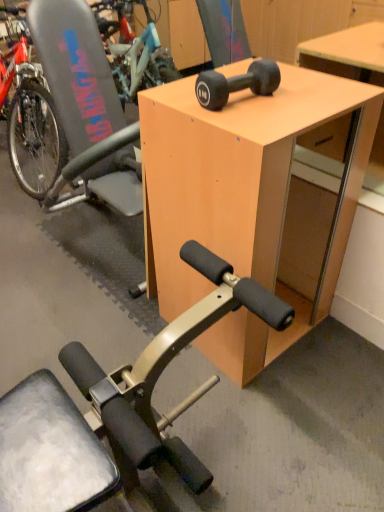
The width and height of the screenshot is (384, 512). What are the coordinates of `gray plastic swivel chair at left` in the screenshot? It's located at (86, 106).

Find the location of `black rubber dumbbell at upper center`. black rubber dumbbell at upper center is located at coordinates (236, 84).

This screenshot has width=384, height=512. In order to click on light wood desk at center in this screenshot , I will do `click(242, 199)`.

At what (x,y) coordinates should I click in order to perform the action: click on desk below the gray plastic swivel chair at left (from the image's perspective). Please return your answer as a coordinate pair (x, y). Image resolution: width=384 pixels, height=512 pixels. Looking at the image, I should click on (242, 199).

Would you say light wood desk at center is part of gray plastic swivel chair at left's contents?

Actually, light wood desk at center is outside gray plastic swivel chair at left.

Is gray plastic swivel chair at left in contact with light wood desk at center?

There is a gap between gray plastic swivel chair at left and light wood desk at center.

Considering the relative sizes of gray plastic swivel chair at left and light wood desk at center in the image provided, is gray plastic swivel chair at left bigger than light wood desk at center?

Yes, gray plastic swivel chair at left is bigger than light wood desk at center.

Image resolution: width=384 pixels, height=512 pixels. Identify the location of wheel in front of the gray plastic swivel chair at left. (236, 84).

From a real-world perspective, who is located higher, black rubber dumbbell at upper center or gray plastic swivel chair at left?

black rubber dumbbell at upper center, from a real-world perspective.

What's the angular difference between black rubber dumbbell at upper center and gray plastic swivel chair at left's facing directions?

There is a 0.546-degree angle between the facing directions of black rubber dumbbell at upper center and gray plastic swivel chair at left.

Is black rubber dumbbell at upper center wider or thinner than gray plastic swivel chair at left?

In the image, black rubber dumbbell at upper center appears to be more narrow than gray plastic swivel chair at left.

Does light wood desk at center lie behind black rubber dumbbell at upper center?

No, light wood desk at center is closer to the camera.

Is black rubber dumbbell at upper center inside light wood desk at center?

No, black rubber dumbbell at upper center is not a part of light wood desk at center.

How many degrees apart are the facing directions of light wood desk at center and black rubber dumbbell at upper center?

The facing directions of light wood desk at center and black rubber dumbbell at upper center are 1.64 degrees apart.

Considering the sizes of objects light wood desk at center and black rubber dumbbell at upper center in the image provided, who is taller, light wood desk at center or black rubber dumbbell at upper center?

With more height is light wood desk at center.

Does gray plastic swivel chair at left have a greater height compared to black rubber dumbbell at upper center?

Indeed, gray plastic swivel chair at left has a greater height compared to black rubber dumbbell at upper center.

Looking at this image, in the image, is gray plastic swivel chair at left on the left side or the right side of black rubber dumbbell at upper center?

Clearly, gray plastic swivel chair at left is on the left of black rubber dumbbell at upper center in the image.

Is black rubber dumbbell at upper center taller than light wood desk at center?

No.

Which is nearer, (266, 72) or (237, 317)?

The point (266, 72) is closer.

From the image's perspective, is black rubber dumbbell at upper center located above or below light wood desk at center?

From the image's perspective, black rubber dumbbell at upper center appears above light wood desk at center.

At what (x,y) coordinates should I click in order to perform the action: click on swivel chair on the left side of light wood desk at center. Please return your answer as a coordinate pair (x, y). The width and height of the screenshot is (384, 512). Looking at the image, I should click on (86, 106).

Is light wood desk at center not close to gray plastic swivel chair at left?

light wood desk at center is actually quite close to gray plastic swivel chair at left.

Which object is more forward, light wood desk at center or gray plastic swivel chair at left?

light wood desk at center is more forward.

Considering the relative sizes of light wood desk at center and gray plastic swivel chair at left in the image provided, is light wood desk at center smaller than gray plastic swivel chair at left?

Yes, light wood desk at center is smaller than gray plastic swivel chair at left.

Where is `desk below the gray plastic swivel chair at left (from a real-world perspective)`? The height and width of the screenshot is (512, 384). desk below the gray plastic swivel chair at left (from a real-world perspective) is located at coordinates (242, 199).

This screenshot has width=384, height=512. I want to click on swivel chair on the left of black rubber dumbbell at upper center, so click(86, 106).

Which object lies nearer to the anchor point light wood desk at center, black rubber dumbbell at upper center or gray plastic swivel chair at left?

Based on the image, black rubber dumbbell at upper center appears to be nearer to light wood desk at center.

Considering their positions, is gray plastic swivel chair at left positioned closer to light wood desk at center than black rubber dumbbell at upper center?

Based on the image, black rubber dumbbell at upper center appears to be nearer to light wood desk at center.

Considering their positions, is light wood desk at center positioned closer to gray plastic swivel chair at left than black rubber dumbbell at upper center?

light wood desk at center.

When comparing their distances from black rubber dumbbell at upper center, does light wood desk at center or gray plastic swivel chair at left seem closer?

light wood desk at center is closer to black rubber dumbbell at upper center.

Considering their positions, is black rubber dumbbell at upper center positioned closer to gray plastic swivel chair at left than light wood desk at center?

Among the two, light wood desk at center is located nearer to gray plastic swivel chair at left.

From the picture: Estimate the real-world distances between objects in this image. Which object is further from black rubber dumbbell at upper center, gray plastic swivel chair at left or light wood desk at center?

gray plastic swivel chair at left is positioned further to the anchor black rubber dumbbell at upper center.

Identify the location of wheel between gray plastic swivel chair at left and light wood desk at center from left to right. (236, 84).